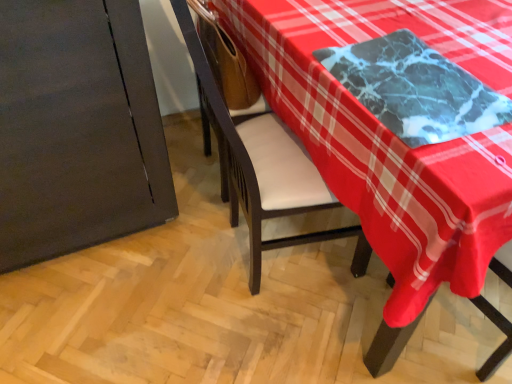
The height and width of the screenshot is (384, 512). I want to click on empty space that is ontop of marble-like black tray at upper right (from a real-world perspective), so click(414, 73).